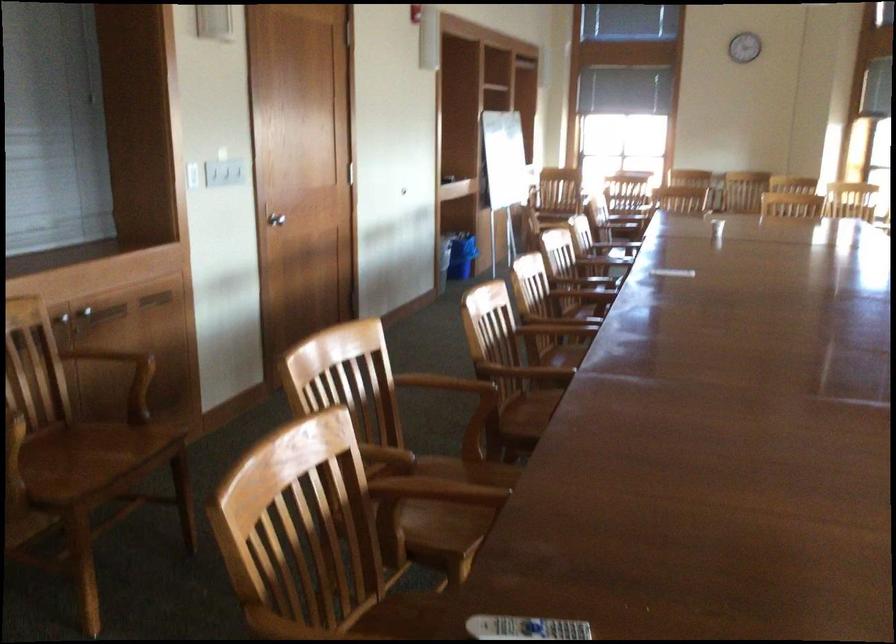
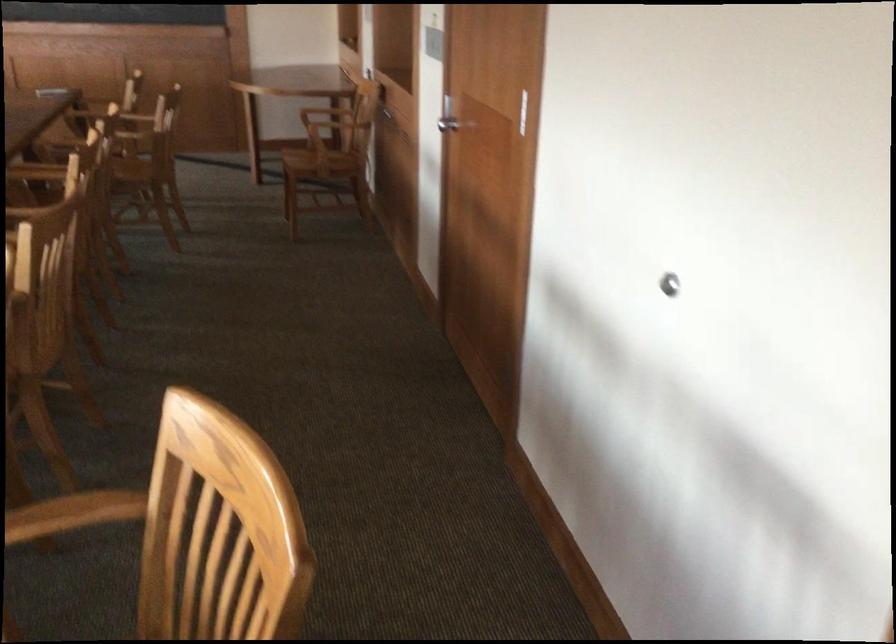
Question: I am providing you with two images of the same scene from different viewpoints. After the viewpoint changes to image2, which objects are now occluded?

Choices:
 (A) chair armrest
 (B) metal sink drain
 (C) cabinet handle
 (D) chair sitting surface

Answer: (C)